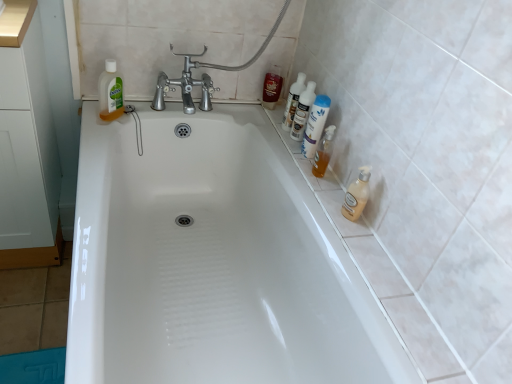
Identify the location of vacant region in front of translucent beige pump bottle at right, which is counted as the 1th cleaning product, starting from the right. (360, 244).